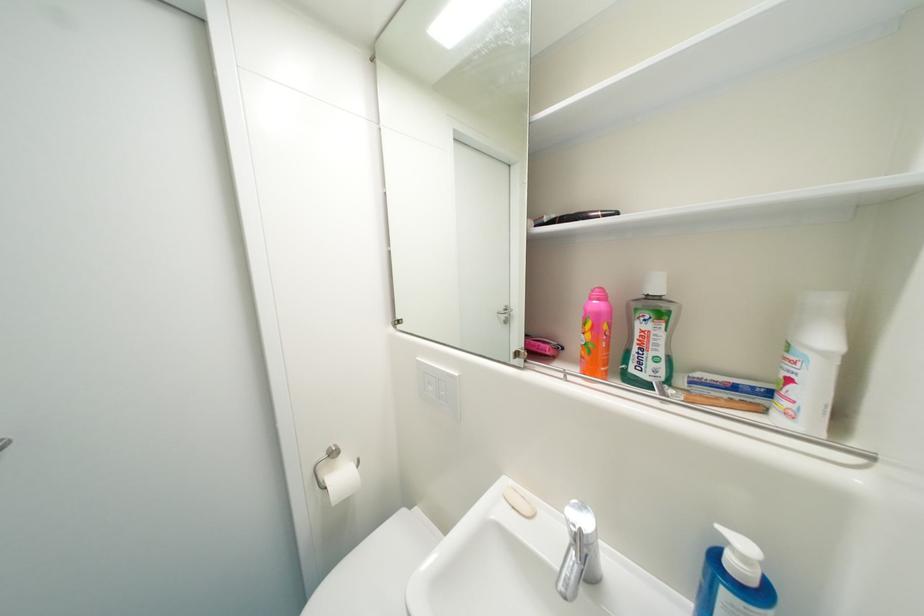
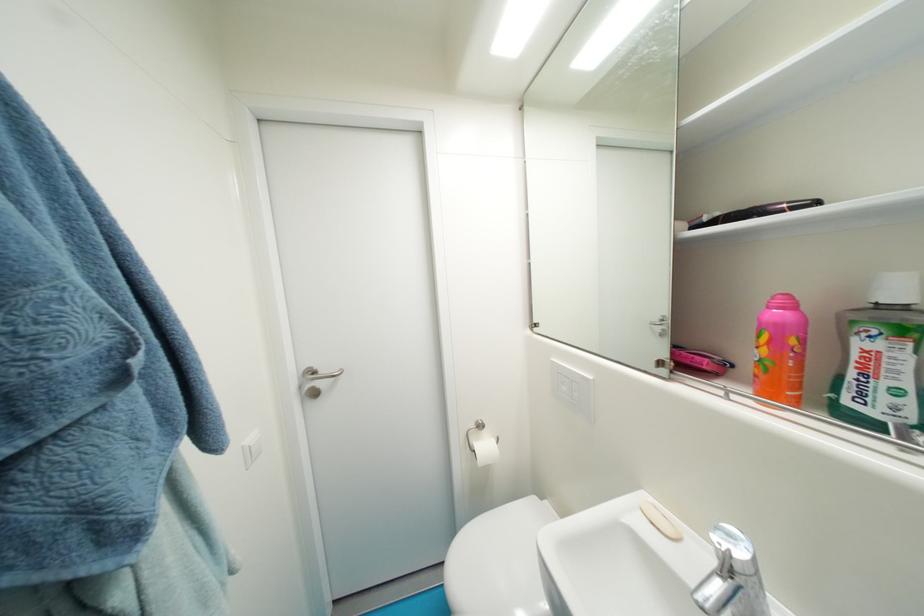
Where in the second image is the point corresponding to (x=561, y=217) from the first image?

(724, 216)